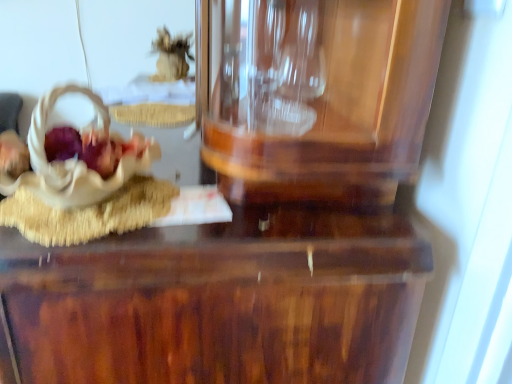
Question: Would you say beige fabric basket at left, the 1th stuff when ordered from bottom to top, is part of matte brown basket at left's contents?

Choices:
 (A) yes
 (B) no

Answer: (B)

Question: Does matte brown basket at left have a lesser height compared to beige fabric basket at left, the second stuff positioned from the top?

Choices:
 (A) yes
 (B) no

Answer: (A)

Question: From the image's perspective, is matte brown basket at left on top of beige fabric basket at left, marked as the second stuff in a back-to-front arrangement?

Choices:
 (A) yes
 (B) no

Answer: (B)

Question: Considering the relative positions of matte brown basket at left and beige fabric basket at left, the 1th stuff when ordered from bottom to top, in the image provided, is matte brown basket at left to the left of beige fabric basket at left, the 1th stuff when ordered from bottom to top, from the viewer's perspective?

Choices:
 (A) no
 (B) yes

Answer: (A)

Question: Can you confirm if matte brown basket at left is bigger than beige fabric basket at left, the second stuff positioned from the top?

Choices:
 (A) no
 (B) yes

Answer: (A)

Question: Is matte brown basket at left wider or thinner than fuzzy brown object at upper center, which is the 2th stuff in bottom-to-top order?

Choices:
 (A) wide
 (B) thin

Answer: (A)

Question: In terms of size, does matte brown basket at left appear bigger or smaller than fuzzy brown object at upper center, which is the 2th stuff in bottom-to-top order?

Choices:
 (A) small
 (B) big

Answer: (A)

Question: From the image's perspective, is matte brown basket at left located above or below fuzzy brown object at upper center, which is the 1th stuff in top-to-bottom order?

Choices:
 (A) above
 (B) below

Answer: (B)

Question: From a real-world perspective, is matte brown basket at left positioned above or below fuzzy brown object at upper center, the second stuff viewed from the front?

Choices:
 (A) above
 (B) below

Answer: (B)

Question: Is point (172, 59) positioned closer to the camera than point (392, 228)?

Choices:
 (A) farther
 (B) closer

Answer: (A)

Question: In terms of width, does fuzzy brown object at upper center, the first stuff positioned from the back, look wider or thinner when compared to glossy wood table at center?

Choices:
 (A) thin
 (B) wide

Answer: (A)

Question: Is fuzzy brown object at upper center, which is the 2th stuff in bottom-to-top order, taller or shorter than glossy wood table at center?

Choices:
 (A) tall
 (B) short

Answer: (B)

Question: Is fuzzy brown object at upper center, which is the 1th stuff in top-to-bottom order, inside the boundaries of glossy wood table at center, or outside?

Choices:
 (A) inside
 (B) outside

Answer: (B)

Question: In terms of size, does beige fabric basket at left, marked as the second stuff in a back-to-front arrangement, appear bigger or smaller than glossy wood table at center?

Choices:
 (A) big
 (B) small

Answer: (B)

Question: From a real-world perspective, is beige fabric basket at left, the second stuff positioned from the top, above or below glossy wood table at center?

Choices:
 (A) below
 (B) above

Answer: (B)